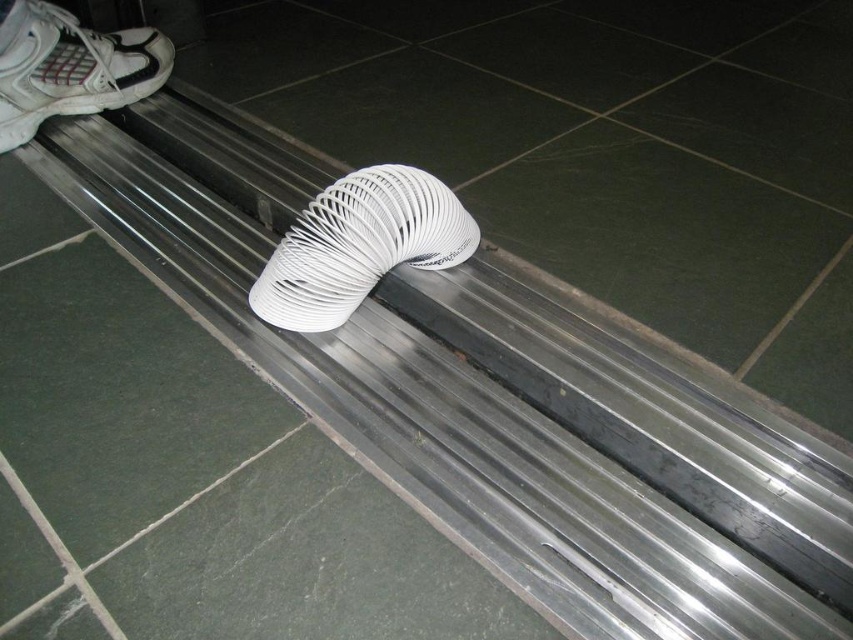
Is white flexible hose at center shorter than white matte shoe at upper left?

Indeed, white flexible hose at center has a lesser height compared to white matte shoe at upper left.

Does white flexible hose at center appear on the right side of white matte shoe at upper left?

Correct, you'll find white flexible hose at center to the right of white matte shoe at upper left.

Is point (288, 256) positioned after point (114, 61)?

No, it is not.

Where is `white flexible hose at center`? Image resolution: width=853 pixels, height=640 pixels. white flexible hose at center is located at coordinates (358, 244).